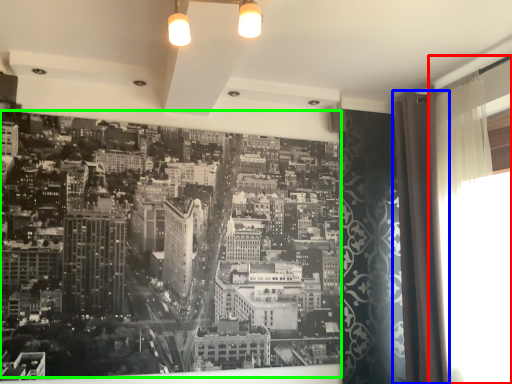
Question: Estimate the real-world distances between objects in this image. Which object is farther from window screen (highlighted by a red box), shower curtain (highlighted by a blue box) or hotel (highlighted by a green box)?

Choices:
 (A) shower curtain
 (B) hotel

Answer: (B)